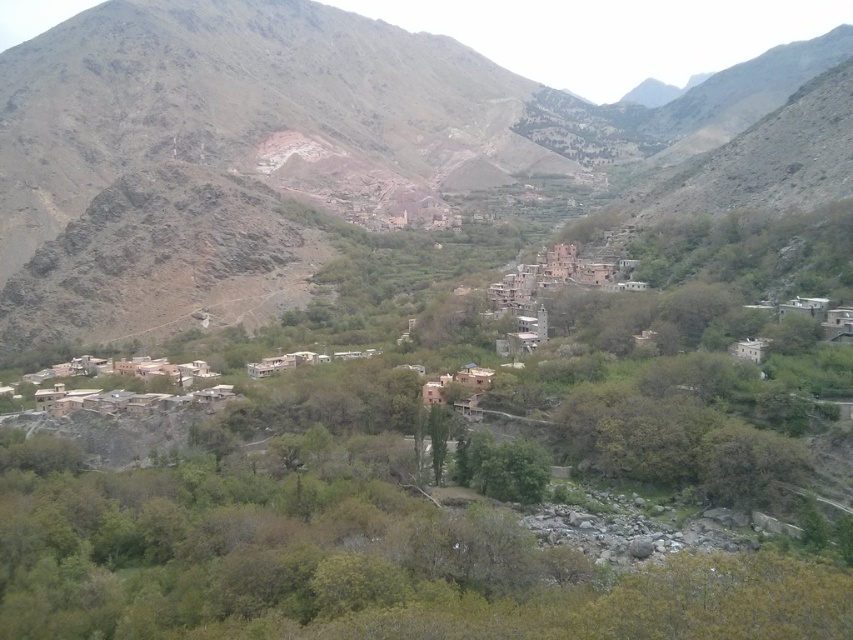
Is brown rocky mountain at center below green leafy tree at center?

No, brown rocky mountain at center is not below green leafy tree at center.

Between point (62, 195) and point (144, 593), which one is positioned in front?

Point (144, 593)

Locate an element on the screen. brown rocky mountain at center is located at coordinates (279, 144).